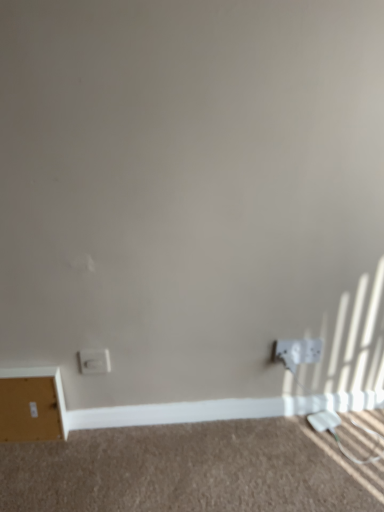
The image size is (384, 512). Describe the element at coordinates (220, 410) in the screenshot. I see `white matte baseboard at lower center` at that location.

Locate an element on the screen. white plastic socket at lower left, the second power plugs and sockets positioned from the right is located at coordinates (94, 361).

From the picture: Is beige carpet at lower center oriented towards white plastic power plugs and sockets at lower right, acting as the 2th power plugs and sockets starting from the left?

No, beige carpet at lower center is not aimed at white plastic power plugs and sockets at lower right, acting as the 2th power plugs and sockets starting from the left.

Is beige carpet at lower center far away from white plastic power plugs and sockets at lower right, acting as the 2th power plugs and sockets starting from the left?

No.

Which of these two, beige carpet at lower center or white plastic power plugs and sockets at lower right, acting as the 2th power plugs and sockets starting from the left, stands shorter?

Standing shorter between the two is beige carpet at lower center.

Could white plastic power plugs and sockets at lower right, acting as the 2th power plugs and sockets starting from the left, be considered to be inside beige carpet at lower center?

That's incorrect, white plastic power plugs and sockets at lower right, acting as the 2th power plugs and sockets starting from the left, is not inside beige carpet at lower center.

Based on the photo, which object is positioned more to the right, beige carpet at lower center or white plastic socket at lower left, the second power plugs and sockets positioned from the right?

From the viewer's perspective, beige carpet at lower center appears more on the right side.

From the picture: From the image's perspective, which one is positioned higher, beige carpet at lower center or white plastic socket at lower left, the second power plugs and sockets positioned from the right?

white plastic socket at lower left, the second power plugs and sockets positioned from the right, appears higher in the image.

Looking at this image, is beige carpet at lower center oriented towards white plastic socket at lower left, the second power plugs and sockets positioned from the right?

No, beige carpet at lower center is not aimed at white plastic socket at lower left, the second power plugs and sockets positioned from the right.

Which object is more forward, beige carpet at lower center or white plastic socket at lower left, the second power plugs and sockets positioned from the right?

beige carpet at lower center is more forward.

Is white plastic power plugs and sockets at lower right, which ranks as the first power plugs and sockets in right-to-left order, inside or outside of white matte file cabinet at lower left?

white plastic power plugs and sockets at lower right, which ranks as the first power plugs and sockets in right-to-left order, is located beyond the bounds of white matte file cabinet at lower left.

From a real-world perspective, which is physically above, white plastic power plugs and sockets at lower right, acting as the 2th power plugs and sockets starting from the left, or white matte file cabinet at lower left?

white plastic power plugs and sockets at lower right, acting as the 2th power plugs and sockets starting from the left, from a real-world perspective.

How many degrees apart are the facing directions of white plastic power plugs and sockets at lower right, which ranks as the first power plugs and sockets in right-to-left order, and white matte file cabinet at lower left?

white plastic power plugs and sockets at lower right, which ranks as the first power plugs and sockets in right-to-left order, and white matte file cabinet at lower left are facing 0.297 degrees away from each other.

Looking at this image, is white plastic power plugs and sockets at lower right, which ranks as the first power plugs and sockets in right-to-left order, positioned before white matte file cabinet at lower left?

No.

From a real-world perspective, is white matte baseboard at lower center below white plastic power outlet at lower right?

Correct, in the physical world, white matte baseboard at lower center is lower than white plastic power outlet at lower right.

Does white matte baseboard at lower center have a larger size compared to white plastic power outlet at lower right?

Indeed, white matte baseboard at lower center has a larger size compared to white plastic power outlet at lower right.

Can you tell me how much white matte baseboard at lower center and white plastic power outlet at lower right differ in facing direction?

white matte baseboard at lower center and white plastic power outlet at lower right are facing 1.07 degrees away from each other.

In the scene shown: Would you say white matte baseboard at lower center is inside or outside white plastic power outlet at lower right?

white matte baseboard at lower center is not inside white plastic power outlet at lower right, it's outside.

Is white matte file cabinet at lower left far from white matte baseboard at lower center?

No, white matte file cabinet at lower left is not far from white matte baseboard at lower center.

From the image's perspective, between white matte file cabinet at lower left and white matte baseboard at lower center, who is located below?

From the image's view, white matte baseboard at lower center is below.

From a real-world perspective, is white matte file cabinet at lower left positioned above or below white matte baseboard at lower center?

From a real-world perspective, white matte file cabinet at lower left is physically above white matte baseboard at lower center.

Does white matte file cabinet at lower left appear on the right side of white plastic power plugs and sockets at lower right, which ranks as the first power plugs and sockets in right-to-left order?

No, white matte file cabinet at lower left is not to the right of white plastic power plugs and sockets at lower right, which ranks as the first power plugs and sockets in right-to-left order.

From a real-world perspective, is white matte file cabinet at lower left on top of white plastic power plugs and sockets at lower right, which ranks as the first power plugs and sockets in right-to-left order?

No, from a real-world perspective, white matte file cabinet at lower left is not over white plastic power plugs and sockets at lower right, which ranks as the first power plugs and sockets in right-to-left order

From the picture: Could you tell me if white matte file cabinet at lower left is facing white plastic power plugs and sockets at lower right, acting as the 2th power plugs and sockets starting from the left?

No, white matte file cabinet at lower left is not oriented towards white plastic power plugs and sockets at lower right, acting as the 2th power plugs and sockets starting from the left.

Would you say white matte file cabinet at lower left is inside or outside white plastic power plugs and sockets at lower right, which ranks as the first power plugs and sockets in right-to-left order?

white matte file cabinet at lower left is located beyond the bounds of white plastic power plugs and sockets at lower right, which ranks as the first power plugs and sockets in right-to-left order.

Where is `plain that appears on the left of white matte baseboard at lower center`? This screenshot has height=512, width=384. plain that appears on the left of white matte baseboard at lower center is located at coordinates (190, 470).

Based on their sizes in the image, would you say white matte baseboard at lower center is bigger or smaller than beige carpet at lower center?

In the image, white matte baseboard at lower center appears to be smaller than beige carpet at lower center.

Considering the relative sizes of white matte baseboard at lower center and beige carpet at lower center in the image provided, is white matte baseboard at lower center thinner than beige carpet at lower center?

Correct, the width of white matte baseboard at lower center is less than that of beige carpet at lower center.

From a real-world perspective, is white matte baseboard at lower center physically located above or below beige carpet at lower center?

In terms of real-world spatial position, white matte baseboard at lower center is above beige carpet at lower center.

You are a GUI agent. You are given a task and a screenshot of the screen. Output one action in this format:
    pyautogui.click(x=<x>, y=<y>)
    Task: Click on the plain below the white plastic power plugs and sockets at lower right, which ranks as the first power plugs and sockets in right-to-left order (from a real-world perspective)
    
    Given the screenshot: What is the action you would take?
    pyautogui.click(x=190, y=470)

From a real-world perspective, count 2nd power plugs and socketss upward from the beige carpet at lower center and point to it. Please provide its 2D coordinates.

[(94, 361)]

Which object lies nearer to the anchor point white plastic power outlet at lower right, beige carpet at lower center or white matte file cabinet at lower left?

Based on the image, beige carpet at lower center appears to be nearer to white plastic power outlet at lower right.

From the image, which object appears to be nearer to white matte file cabinet at lower left, white plastic power plugs and sockets at lower right, which ranks as the first power plugs and sockets in right-to-left order, or white plastic power outlet at lower right?

white plastic power outlet at lower right is closer to white matte file cabinet at lower left.

When comparing their distances from white plastic power plugs and sockets at lower right, which ranks as the first power plugs and sockets in right-to-left order, does white matte file cabinet at lower left or white plastic socket at lower left, the second power plugs and sockets positioned from the right, seem further?

white matte file cabinet at lower left.

Considering their positions, is white plastic power plugs and sockets at lower right, acting as the 2th power plugs and sockets starting from the left, positioned closer to white plastic socket at lower left, which ranks as the 1th power plugs and sockets in left-to-right order, than white matte file cabinet at lower left?

Based on the image, white matte file cabinet at lower left appears to be nearer to white plastic socket at lower left, which ranks as the 1th power plugs and sockets in left-to-right order.

When comparing their distances from white plastic power outlet at lower right, does white plastic power plugs and sockets at lower right, which ranks as the first power plugs and sockets in right-to-left order, or white plastic socket at lower left, the second power plugs and sockets positioned from the right, seem closer?

white plastic power plugs and sockets at lower right, which ranks as the first power plugs and sockets in right-to-left order, is positioned closer to the anchor white plastic power outlet at lower right.

From the image, which object appears to be nearer to white plastic power outlet at lower right, white matte baseboard at lower center or white plastic power plugs and sockets at lower right, which ranks as the first power plugs and sockets in right-to-left order?

white plastic power plugs and sockets at lower right, which ranks as the first power plugs and sockets in right-to-left order, is closer to white plastic power outlet at lower right.

Consider the image. Estimate the real-world distances between objects in this image. Which object is closer to white matte baseboard at lower center, white plastic socket at lower left, the second power plugs and sockets positioned from the right, or white plastic power outlet at lower right?

white plastic power outlet at lower right is positioned closer to the anchor white matte baseboard at lower center.

From the image, which object appears to be farther from white plastic power outlet at lower right, white matte baseboard at lower center or beige carpet at lower center?

beige carpet at lower center is positioned further to the anchor white plastic power outlet at lower right.

The image size is (384, 512). In order to click on plain situated between white plastic socket at lower left, the second power plugs and sockets positioned from the right, and white matte baseboard at lower center from left to right in this screenshot , I will do `click(190, 470)`.

Locate an element on the screen. This screenshot has width=384, height=512. plain between white matte file cabinet at lower left and white plastic power outlet at lower right in the horizontal direction is located at coordinates (190, 470).

At what (x,y) coordinates should I click in order to perform the action: click on plain between white matte file cabinet at lower left and white plastic power plugs and sockets at lower right, which ranks as the first power plugs and sockets in right-to-left order, from left to right. Please return your answer as a coordinate pair (x, y). The height and width of the screenshot is (512, 384). Looking at the image, I should click on (190, 470).

Identify the location of power plugs and sockets situated between white matte file cabinet at lower left and white matte baseboard at lower center from left to right. (94, 361).